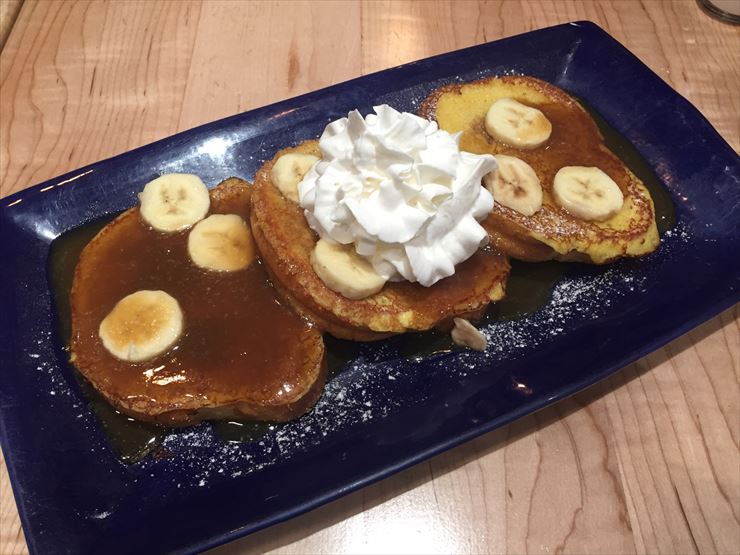
Where is `table`? table is located at coordinates click(553, 509).